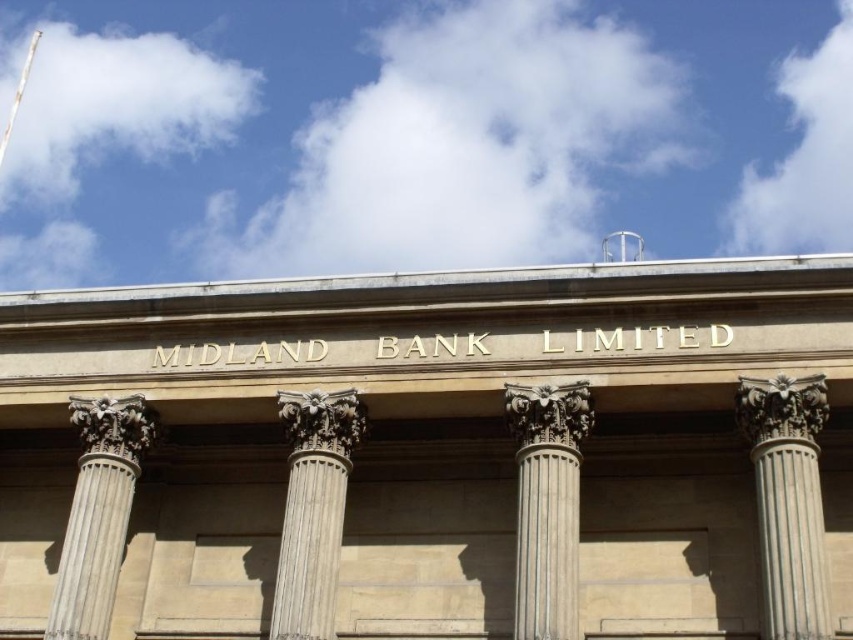
Can you confirm if white stone column at right is wider than white marble column at center?

No, white stone column at right is not wider than white marble column at center.

Can you confirm if white stone column at right is smaller than white marble column at center?

Correct, white stone column at right occupies less space than white marble column at center.

Which is in front, point (793, 486) or point (283, 547)?

Positioned in front is point (793, 486).

Where is `white stone column at right`? white stone column at right is located at coordinates coord(788,500).

Is gray stone column at center to the left of white stone column at left from the viewer's perspective?

Incorrect, gray stone column at center is not on the left side of white stone column at left.

Who is positioned more to the right, gray stone column at center or white stone column at left?

gray stone column at center

The image size is (853, 640). In order to click on gray stone column at center in this screenshot , I will do `click(547, 504)`.

In the scene shown: Is white marble column at center in front of white stone column at left?

No, white marble column at center is behind white stone column at left.

Between white marble column at center and white stone column at left, which one is positioned lower?

Positioned lower is white stone column at left.

Is point (289, 512) closer to camera compared to point (132, 429)?

Yes, it is.

Locate an element on the screen. white marble column at center is located at coordinates (312, 508).